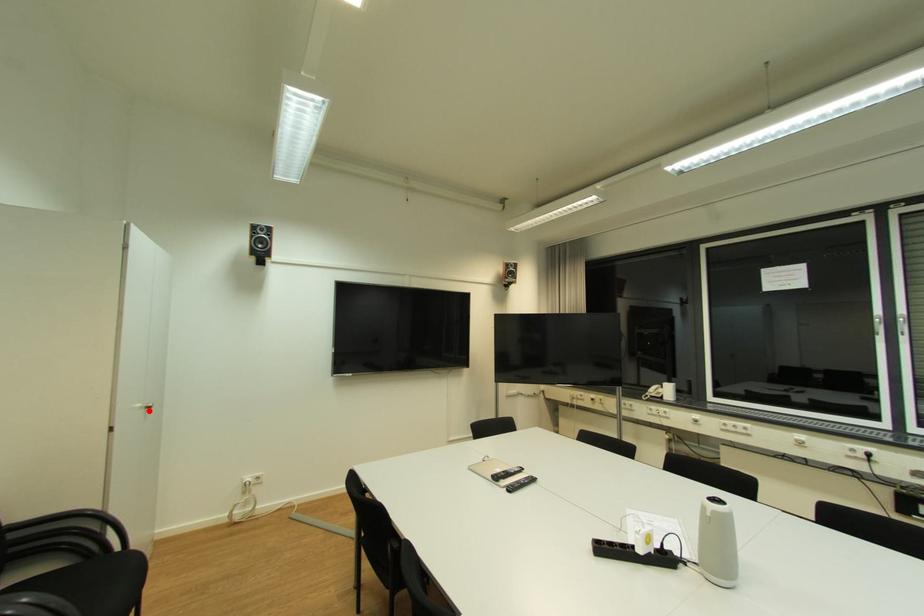
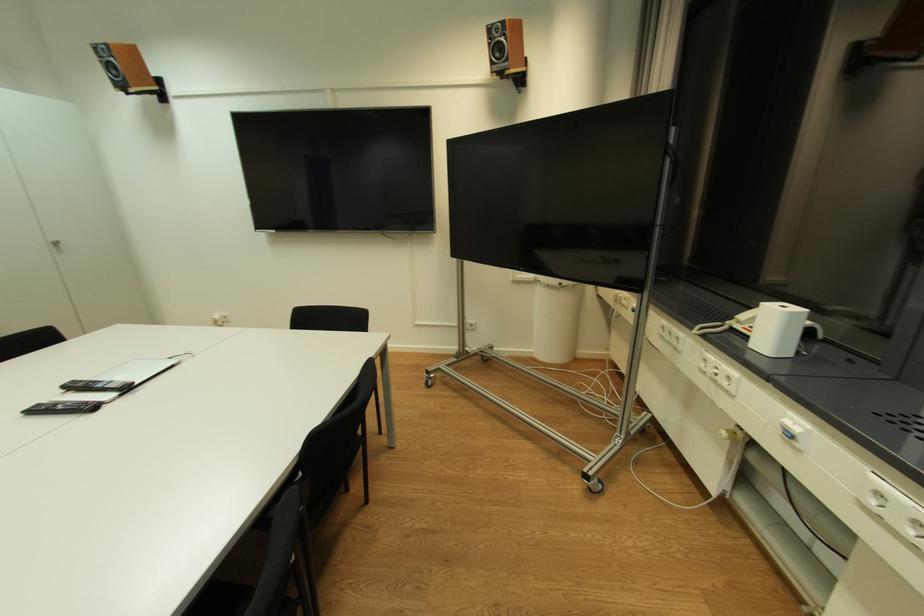
Where in the second image is the point corresponding to the highlighted location from the first image?

(57, 246)